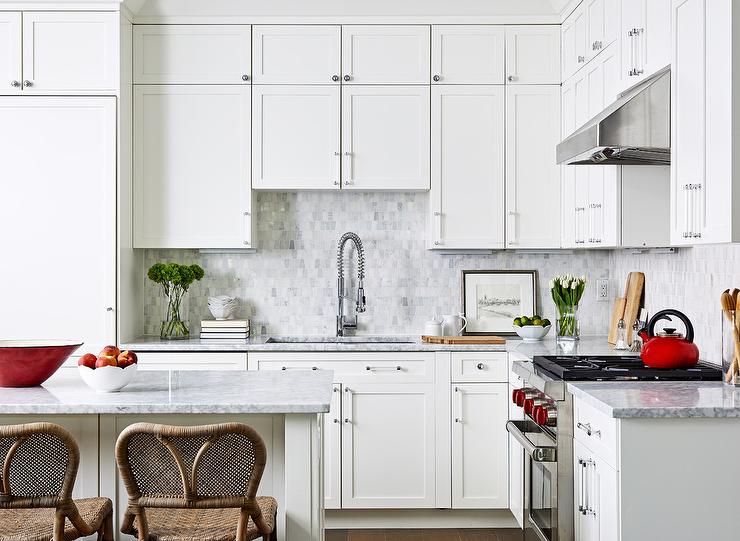
This screenshot has height=541, width=740. Find the location of `countertop`. countertop is located at coordinates pos(635,399), pos(528,346), pos(180,338), pos(192,382).